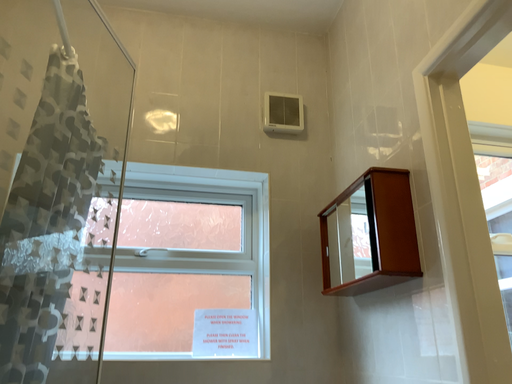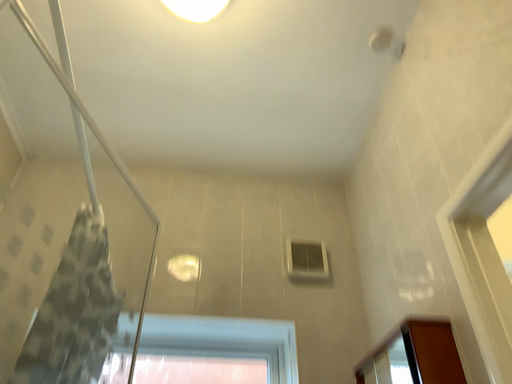
Question: Which way did the camera rotate in the video?

Choices:
 (A) rotated upward
 (B) rotated downward

Answer: (A)